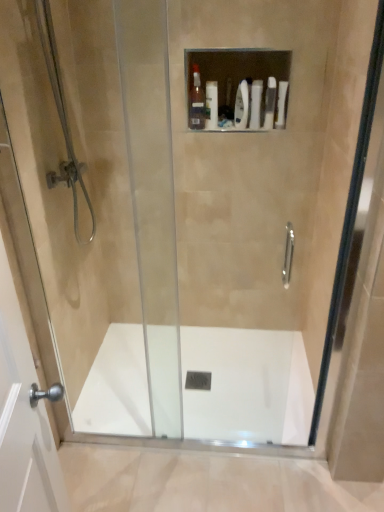
The image size is (384, 512). Find the location of `vacant space situated on the left part of clear glass shower door at left`. vacant space situated on the left part of clear glass shower door at left is located at coordinates (89, 452).